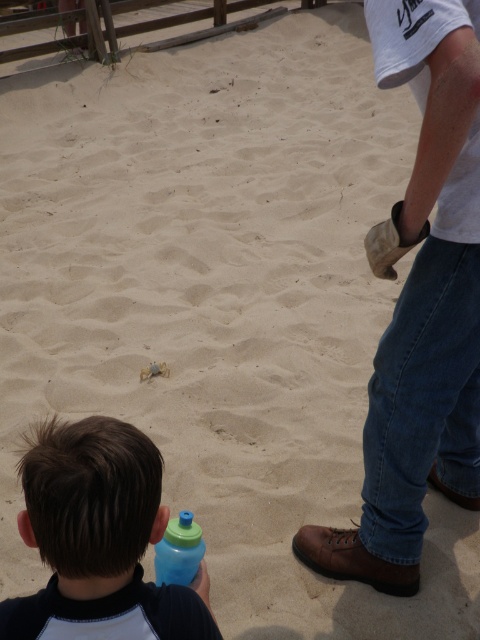
Question: Is blue matte water bottle at lower left above blue translucent bottle at lower center?

Choices:
 (A) yes
 (B) no

Answer: (A)

Question: Is blue matte water bottle at lower left closer to camera compared to blue translucent bottle at lower center?

Choices:
 (A) no
 (B) yes

Answer: (B)

Question: Which object is farther from the camera taking this photo?

Choices:
 (A) blue matte water bottle at lower left
 (B) blue translucent bottle at lower center

Answer: (B)

Question: Which object is closer to the camera taking this photo?

Choices:
 (A) blue matte water bottle at lower left
 (B) blue translucent bottle at lower center
 (C) brown leather shoe at lower right

Answer: (A)

Question: Considering the relative positions of brown leather shoe at lower right and blue translucent bottle at lower center in the image provided, where is brown leather shoe at lower right located with respect to blue translucent bottle at lower center?

Choices:
 (A) above
 (B) below

Answer: (A)

Question: Among these objects, which one is farthest from the camera?

Choices:
 (A) blue matte water bottle at lower left
 (B) blue translucent bottle at lower center

Answer: (B)